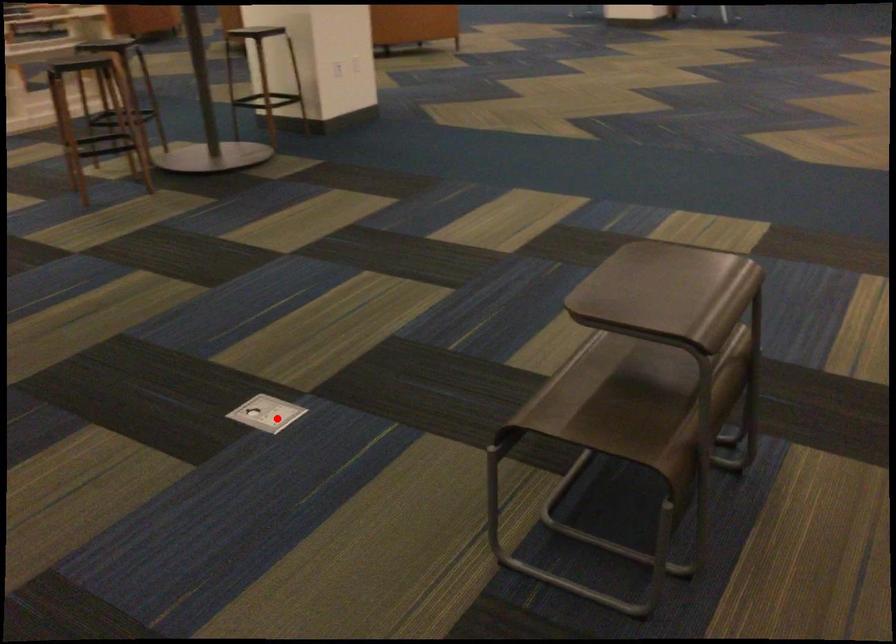
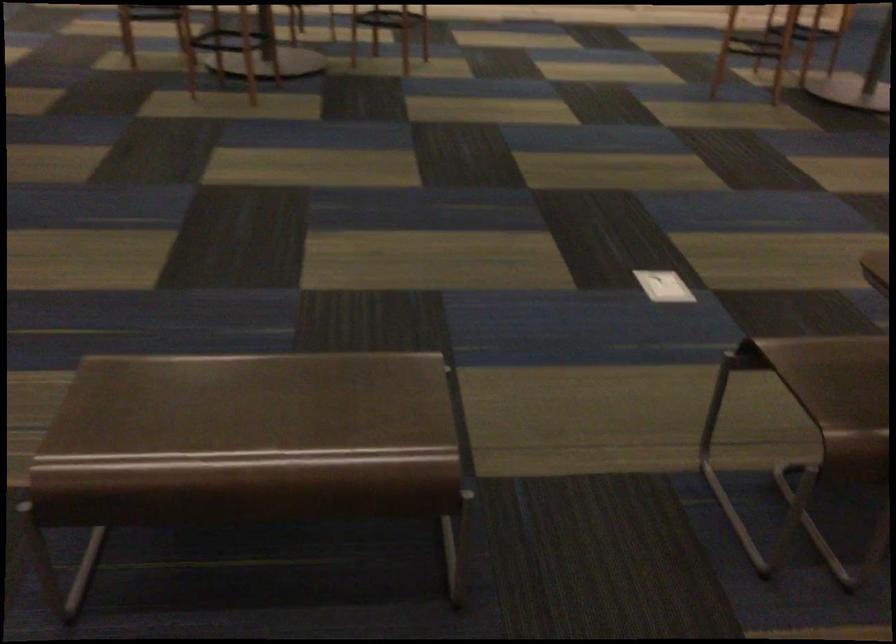
Question: I am providing you with two images of the same scene from different viewpoints. Image1 has a red point marked. In image2, the corresponding 3D location appears at what relative position? Reply with the corresponding letter.

Choices:
 (A) Closer
 (B) Farther

Answer: (B)